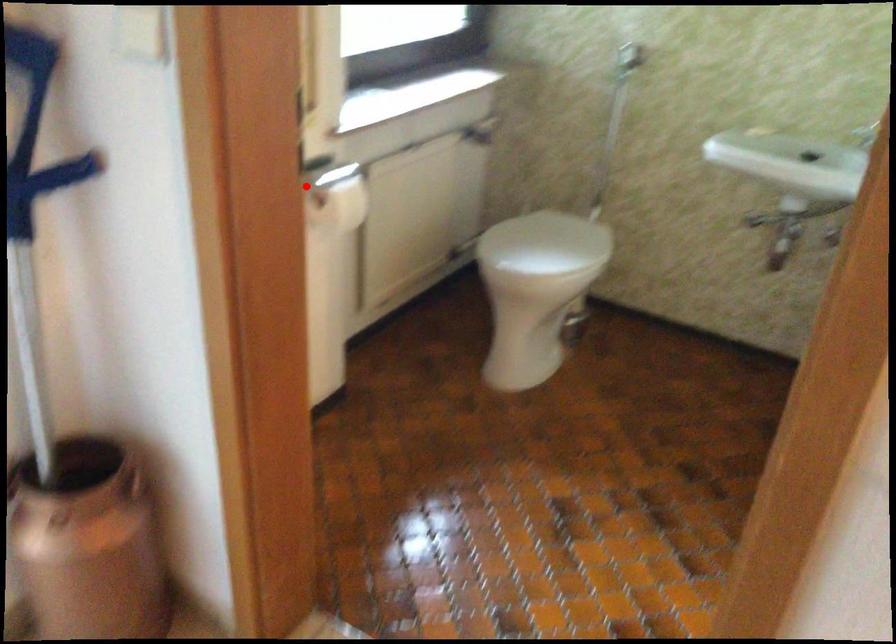
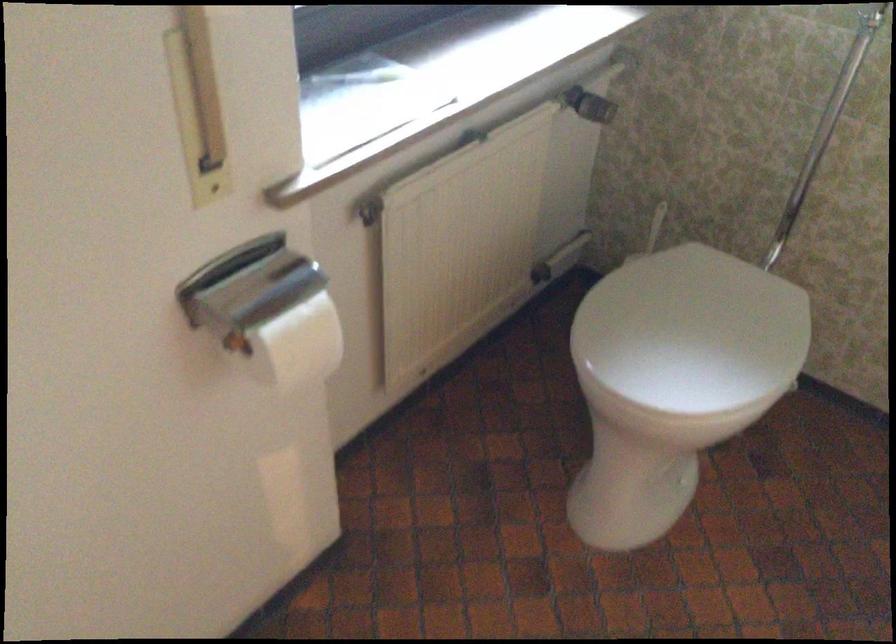
Question: I am providing you with two images of the same scene from different viewpoints. Image1 has a red point marked. In image2, the corresponding 3D location appears at what relative position? Reply with the corresponding letter.

Choices:
 (A) Closer
 (B) Farther

Answer: (A)